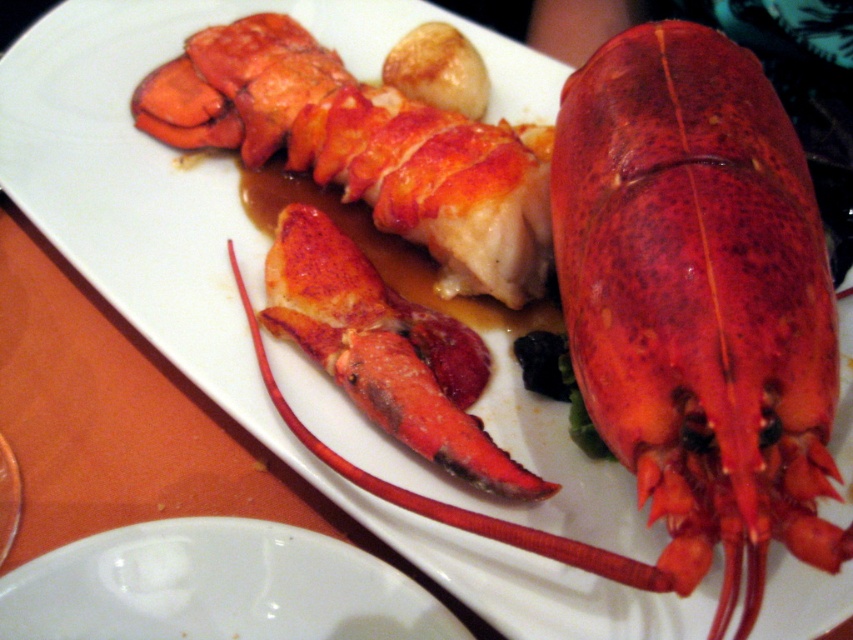
Question: Which object is farther from the camera taking this photo?

Choices:
 (A) white glossy plate at lower center
 (B) shiny red lobster at center

Answer: (B)

Question: Can you confirm if shiny red lobster at center is positioned above white glossy plate at lower center?

Choices:
 (A) no
 (B) yes

Answer: (B)

Question: Is shiny red lobster at center smaller than white glossy plate at lower center?

Choices:
 (A) yes
 (B) no

Answer: (B)

Question: Considering the relative positions of shiny red lobster at center and white glossy plate at lower center in the image provided, where is shiny red lobster at center located with respect to white glossy plate at lower center?

Choices:
 (A) below
 (B) above

Answer: (B)

Question: Which object appears closest to the camera in this image?

Choices:
 (A) shiny red lobster at center
 (B) white glossy plate at lower center

Answer: (B)